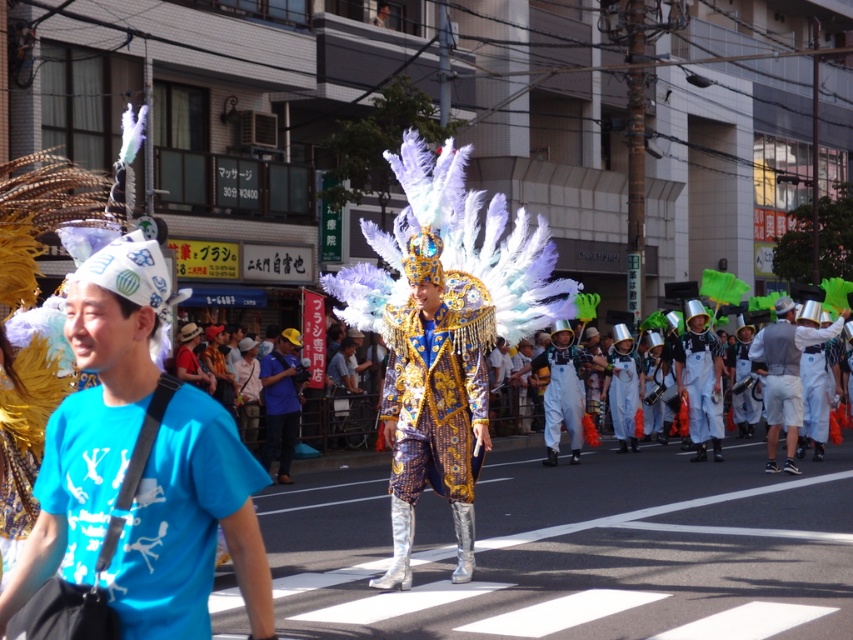
Question: Which point is closer to the camera?

Choices:
 (A) white paper hat at left
 (B) white fabric pants at right
 (C) silver metallic helmet at right
 (D) blue fabric hat at center

Answer: (A)

Question: Does white metallic overalls at center appear on the left side of white fabric pants at right?

Choices:
 (A) yes
 (B) no

Answer: (A)

Question: Is silver metallic helmet at right further to camera compared to white metallic overalls at center?

Choices:
 (A) no
 (B) yes

Answer: (A)

Question: Does silver metallic helmet at right have a larger size compared to white metallic overalls at center?

Choices:
 (A) yes
 (B) no

Answer: (A)

Question: Which of the following is the closest to the observer?

Choices:
 (A) blue fabric hat at center
 (B) white metallic overalls at center

Answer: (A)

Question: Which is nearer to the white fabric pants at right?

Choices:
 (A) silver metallic helmet at right
 (B) white paper hat at left
 (C) white metallic overalls at center

Answer: (C)